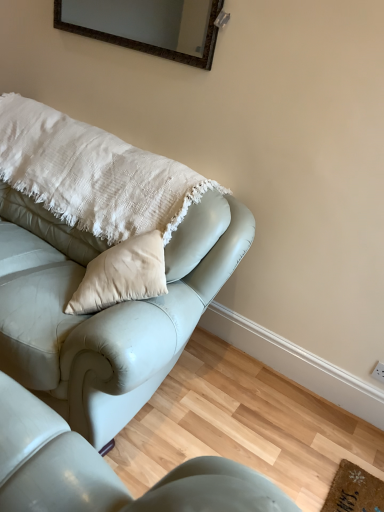
Describe the element at coordinates (93, 174) in the screenshot. This screenshot has width=384, height=512. I see `white cotton pillow at upper left` at that location.

Where is `leather couch at lower left, marked as the 2th studio couch in a top-to-bottom arrangement`? The height and width of the screenshot is (512, 384). leather couch at lower left, marked as the 2th studio couch in a top-to-bottom arrangement is located at coordinates (107, 471).

Describe the element at coordinates (105, 309) in the screenshot. I see `matte leather couch at upper left, which appears as the first studio couch when viewed from the top` at that location.

Locate an element on the screen. This screenshot has height=512, width=384. matte leather couch at upper left, which appears as the 2th studio couch when ordered from the bottom is located at coordinates (105, 309).

The height and width of the screenshot is (512, 384). I want to click on white cotton pillow at upper left, so click(x=93, y=174).

How different are the orientations of matte leather couch at upper left, which appears as the first studio couch when viewed from the top, and leather couch at lower left, positioned as the 1th studio couch in bottom-to-top order, in degrees?

The facing directions of matte leather couch at upper left, which appears as the first studio couch when viewed from the top, and leather couch at lower left, positioned as the 1th studio couch in bottom-to-top order, are 89.8 degrees apart.

Looking at this image, between matte leather couch at upper left, which appears as the 2th studio couch when ordered from the bottom, and leather couch at lower left, positioned as the 1th studio couch in bottom-to-top order, which one has larger width?

leather couch at lower left, positioned as the 1th studio couch in bottom-to-top order.

Locate an element on the screen. studio couch to the right of matte leather couch at upper left, which appears as the first studio couch when viewed from the top is located at coordinates (107, 471).

Considering the positions of objects matte leather couch at upper left, which appears as the 2th studio couch when ordered from the bottom, and leather couch at lower left, marked as the 2th studio couch in a top-to-bottom arrangement, in the image provided, who is more to the right, matte leather couch at upper left, which appears as the 2th studio couch when ordered from the bottom, or leather couch at lower left, marked as the 2th studio couch in a top-to-bottom arrangement,?

leather couch at lower left, marked as the 2th studio couch in a top-to-bottom arrangement.

Which object is wider, leather couch at lower left, positioned as the 1th studio couch in bottom-to-top order, or matte brown frame at upper center?

Wider between the two is leather couch at lower left, positioned as the 1th studio couch in bottom-to-top order.

Which is farther from the camera, (257,477) or (65,7)?

The point (65,7) is farther from the camera.

Where is `mirror lying on the left of leather couch at lower left, marked as the 2th studio couch in a top-to-bottom arrangement`? mirror lying on the left of leather couch at lower left, marked as the 2th studio couch in a top-to-bottom arrangement is located at coordinates tap(147, 26).

Based on the photo, in the image, is leather couch at lower left, positioned as the 1th studio couch in bottom-to-top order, on the left side or the right side of matte brown frame at upper center?

leather couch at lower left, positioned as the 1th studio couch in bottom-to-top order, is positioned on matte brown frame at upper center's right side.

Which object is closer to the camera taking this photo, matte leather couch at upper left, which appears as the first studio couch when viewed from the top, or white cotton pillow at upper left?

matte leather couch at upper left, which appears as the first studio couch when viewed from the top.

How many degrees apart are the facing directions of matte leather couch at upper left, which appears as the 2th studio couch when ordered from the bottom, and white cotton pillow at upper left?

The facing directions of matte leather couch at upper left, which appears as the 2th studio couch when ordered from the bottom, and white cotton pillow at upper left are 0.529 degrees apart.

Can white cotton pillow at upper left be found inside matte leather couch at upper left, which appears as the first studio couch when viewed from the top?

Yes, white cotton pillow at upper left is a part of matte leather couch at upper left, which appears as the first studio couch when viewed from the top.

From the image's perspective, count 1st studio couchs downward from the white cotton pillow at upper left and point to it. Please provide its 2D coordinates.

[(105, 309)]

Does leather couch at lower left, marked as the 2th studio couch in a top-to-bottom arrangement, have a larger size compared to white cotton pillow at upper left?

No, leather couch at lower left, marked as the 2th studio couch in a top-to-bottom arrangement, is not bigger than white cotton pillow at upper left.

Can you tell me how much leather couch at lower left, marked as the 2th studio couch in a top-to-bottom arrangement, and white cotton pillow at upper left differ in facing direction?

90.3 degrees separate the facing orientations of leather couch at lower left, marked as the 2th studio couch in a top-to-bottom arrangement, and white cotton pillow at upper left.

From the image's perspective, who appears lower, leather couch at lower left, marked as the 2th studio couch in a top-to-bottom arrangement, or white cotton pillow at upper left?

From the image's view, leather couch at lower left, marked as the 2th studio couch in a top-to-bottom arrangement, is below.

Is leather couch at lower left, marked as the 2th studio couch in a top-to-bottom arrangement, turned away from white cotton pillow at upper left?

No.

Considering the positions of point (33, 139) and point (39, 103), is point (33, 139) closer or farther from the camera than point (39, 103)?

Clearly, point (33, 139) is closer to the camera than point (39, 103).

Looking at this image, from the image's perspective, between white cotton pillow at upper left and matte leather couch at upper left, which appears as the 2th studio couch when ordered from the bottom, which one is located above?

From the image's view, white cotton pillow at upper left is above.

Which of these two, white cotton pillow at upper left or matte leather couch at upper left, which appears as the first studio couch when viewed from the top, stands taller?

matte leather couch at upper left, which appears as the first studio couch when viewed from the top.

Is white cotton pillow at upper left positioned with its back to matte leather couch at upper left, which appears as the first studio couch when viewed from the top?

Yes, matte leather couch at upper left, which appears as the first studio couch when viewed from the top, is at the back of white cotton pillow at upper left.

Image resolution: width=384 pixels, height=512 pixels. Find the location of `pillow that is in front of the matte brown frame at upper center`. pillow that is in front of the matte brown frame at upper center is located at coordinates (93, 174).

Looking at this image, can we say matte brown frame at upper center lies outside white cotton pillow at upper left?

Yes, matte brown frame at upper center is outside of white cotton pillow at upper left.

What's the angular difference between matte brown frame at upper center and white cotton pillow at upper left's facing directions?

0.622 degrees.

Does matte brown frame at upper center have a larger size compared to white cotton pillow at upper left?

Incorrect, matte brown frame at upper center is not larger than white cotton pillow at upper left.

Looking at the image, does matte brown frame at upper center seem bigger or smaller compared to leather couch at lower left, positioned as the 1th studio couch in bottom-to-top order?

matte brown frame at upper center is smaller than leather couch at lower left, positioned as the 1th studio couch in bottom-to-top order.

Is matte brown frame at upper center positioned with its back to leather couch at lower left, marked as the 2th studio couch in a top-to-bottom arrangement?

No, matte brown frame at upper center is not facing away from leather couch at lower left, marked as the 2th studio couch in a top-to-bottom arrangement.

Can you confirm if matte brown frame at upper center is shorter than leather couch at lower left, marked as the 2th studio couch in a top-to-bottom arrangement?

Incorrect, the height of matte brown frame at upper center does not fall short of that of leather couch at lower left, marked as the 2th studio couch in a top-to-bottom arrangement.

Is matte brown frame at upper center in contact with leather couch at lower left, marked as the 2th studio couch in a top-to-bottom arrangement?

No, matte brown frame at upper center is not beside leather couch at lower left, marked as the 2th studio couch in a top-to-bottom arrangement.

Where is `studio couch behind the leather couch at lower left, marked as the 2th studio couch in a top-to-bottom arrangement`? The height and width of the screenshot is (512, 384). studio couch behind the leather couch at lower left, marked as the 2th studio couch in a top-to-bottom arrangement is located at coordinates pos(105,309).

This screenshot has height=512, width=384. I want to click on mirror located above the leather couch at lower left, marked as the 2th studio couch in a top-to-bottom arrangement (from the image's perspective), so click(147, 26).

When comparing their distances from matte leather couch at upper left, which appears as the first studio couch when viewed from the top, does white cotton pillow at upper left or matte brown frame at upper center seem further?

Based on the image, matte brown frame at upper center appears to be further to matte leather couch at upper left, which appears as the first studio couch when viewed from the top.

Which object lies further to the anchor point white cotton pillow at upper left, leather couch at lower left, positioned as the 1th studio couch in bottom-to-top order, or matte brown frame at upper center?

leather couch at lower left, positioned as the 1th studio couch in bottom-to-top order, lies further to white cotton pillow at upper left than the other object.

When comparing their distances from white cotton pillow at upper left, does matte leather couch at upper left, which appears as the 2th studio couch when ordered from the bottom, or matte brown frame at upper center seem further?

matte brown frame at upper center is further to white cotton pillow at upper left.

From the image, which object appears to be nearer to matte brown frame at upper center, leather couch at lower left, marked as the 2th studio couch in a top-to-bottom arrangement, or white cotton pillow at upper left?

white cotton pillow at upper left is closer to matte brown frame at upper center.

From the image, which object appears to be nearer to leather couch at lower left, positioned as the 1th studio couch in bottom-to-top order, matte leather couch at upper left, which appears as the 2th studio couch when ordered from the bottom, or matte brown frame at upper center?

matte leather couch at upper left, which appears as the 2th studio couch when ordered from the bottom.

From the picture: Considering their positions, is leather couch at lower left, marked as the 2th studio couch in a top-to-bottom arrangement, positioned further to matte leather couch at upper left, which appears as the first studio couch when viewed from the top, than white cotton pillow at upper left?

The object further to matte leather couch at upper left, which appears as the first studio couch when viewed from the top, is leather couch at lower left, marked as the 2th studio couch in a top-to-bottom arrangement.

From the image, which object appears to be nearer to matte leather couch at upper left, which appears as the 2th studio couch when ordered from the bottom, leather couch at lower left, positioned as the 1th studio couch in bottom-to-top order, or matte brown frame at upper center?

The object closer to matte leather couch at upper left, which appears as the 2th studio couch when ordered from the bottom, is leather couch at lower left, positioned as the 1th studio couch in bottom-to-top order.

When comparing their distances from matte leather couch at upper left, which appears as the 2th studio couch when ordered from the bottom, does matte brown frame at upper center or white cotton pillow at upper left seem closer?

Based on the image, white cotton pillow at upper left appears to be nearer to matte leather couch at upper left, which appears as the 2th studio couch when ordered from the bottom.

Where is `studio couch between matte brown frame at upper center and leather couch at lower left, positioned as the 1th studio couch in bottom-to-top order, from top to bottom`? The width and height of the screenshot is (384, 512). studio couch between matte brown frame at upper center and leather couch at lower left, positioned as the 1th studio couch in bottom-to-top order, from top to bottom is located at coordinates (105, 309).

Where is `pillow between matte brown frame at upper center and leather couch at lower left, positioned as the 1th studio couch in bottom-to-top order, in the vertical direction`? The image size is (384, 512). pillow between matte brown frame at upper center and leather couch at lower left, positioned as the 1th studio couch in bottom-to-top order, in the vertical direction is located at coordinates (93, 174).

Find the location of a particular element. studio couch between white cotton pillow at upper left and leather couch at lower left, positioned as the 1th studio couch in bottom-to-top order, vertically is located at coordinates (105, 309).

Where is `pillow between matte brown frame at upper center and matte leather couch at upper left, which appears as the first studio couch when viewed from the top, vertically`? pillow between matte brown frame at upper center and matte leather couch at upper left, which appears as the first studio couch when viewed from the top, vertically is located at coordinates (93, 174).